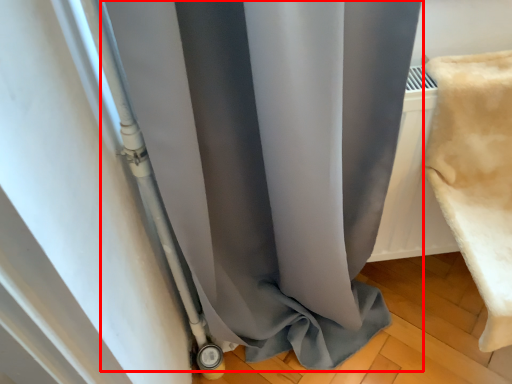
Question: Considering the relative positions of curtain (annotated by the red box) and material in the image provided, where is curtain (annotated by the red box) located with respect to the staircase?

Choices:
 (A) right
 (B) left

Answer: (B)